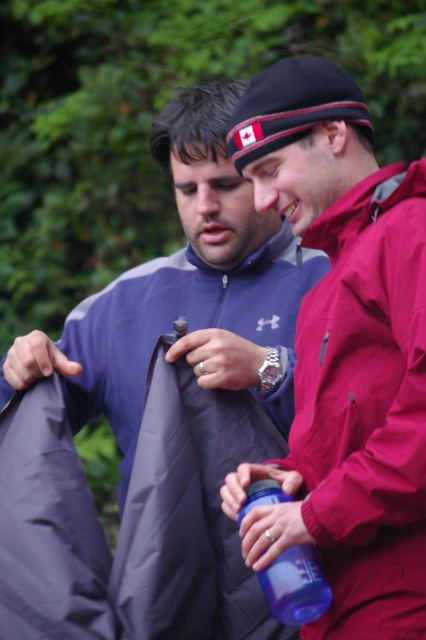
Which is more to the left, matte blue jacket at center or matte red jacket at right?

matte blue jacket at center

Is matte blue jacket at center above matte red jacket at right?

Actually, matte blue jacket at center is below matte red jacket at right.

Between point (19, 502) and point (291, 518), which one is positioned behind?

Positioned behind is point (19, 502).

Locate an element on the screen. matte blue jacket at center is located at coordinates (157, 413).

Does matte blue jacket at center appear on the right side of blue plastic water bottle at center?

Incorrect, matte blue jacket at center is not on the right side of blue plastic water bottle at center.

Is matte blue jacket at center bigger than blue plastic water bottle at center?

Yes, matte blue jacket at center is bigger than blue plastic water bottle at center.

Where is `matte blue jacket at center`? The image size is (426, 640). matte blue jacket at center is located at coordinates (157, 413).

From the picture: Does matte red jacket at right have a smaller size compared to blue plastic water bottle at center?

Incorrect, matte red jacket at right is not smaller in size than blue plastic water bottle at center.

Measure the distance between matte red jacket at right and blue plastic water bottle at center.

The distance of matte red jacket at right from blue plastic water bottle at center is 9.82 inches.

Find the location of a particular element. This screenshot has width=426, height=640. matte red jacket at right is located at coordinates (344, 352).

I want to click on matte red jacket at right, so click(x=344, y=352).